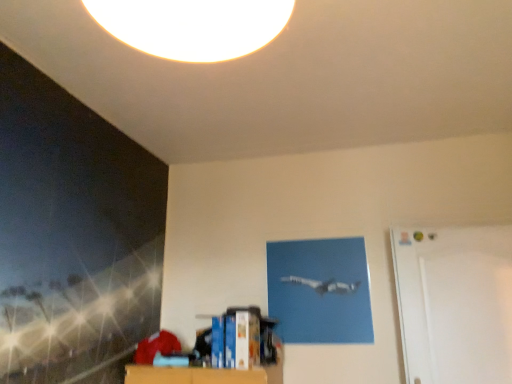
Question: Should I look upward or downward to see white matte door at right?

Choices:
 (A) up
 (B) down

Answer: (B)